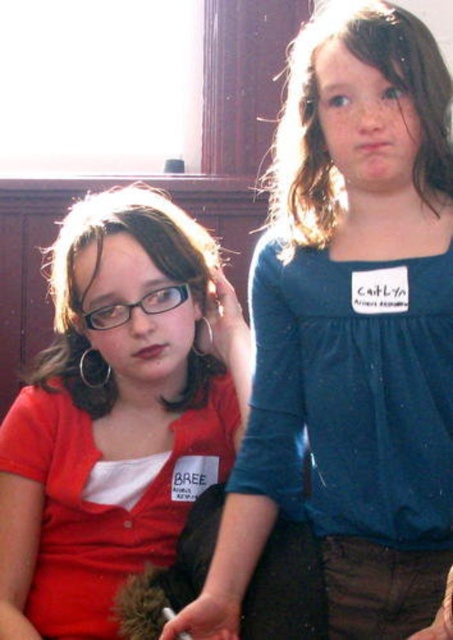
You are a photographer who needs to adjust the focus of your camera to capture the matte blue shirt at upper right clearly. The camera requires the distance in meters to set the focus. What should the distance be set to?

The distance between the matte blue shirt at upper right and the camera is 89.94 centimeters, which converts to 0.8994 meters. Therefore, the camera should be set to 0.9 meters to focus on the matte blue shirt at upper right.

You are at a school event and see two girls wearing name tags. One is wearing a matte blue shirt at upper right and the other a matte red shirt at left. Which girl is sitting to the right of the other?

The matte blue shirt at upper right is positioned on the right side of the matte red shirt at left, so the girl wearing the matte blue shirt at upper right is sitting to the right of the girl in the matte red shirt at left.